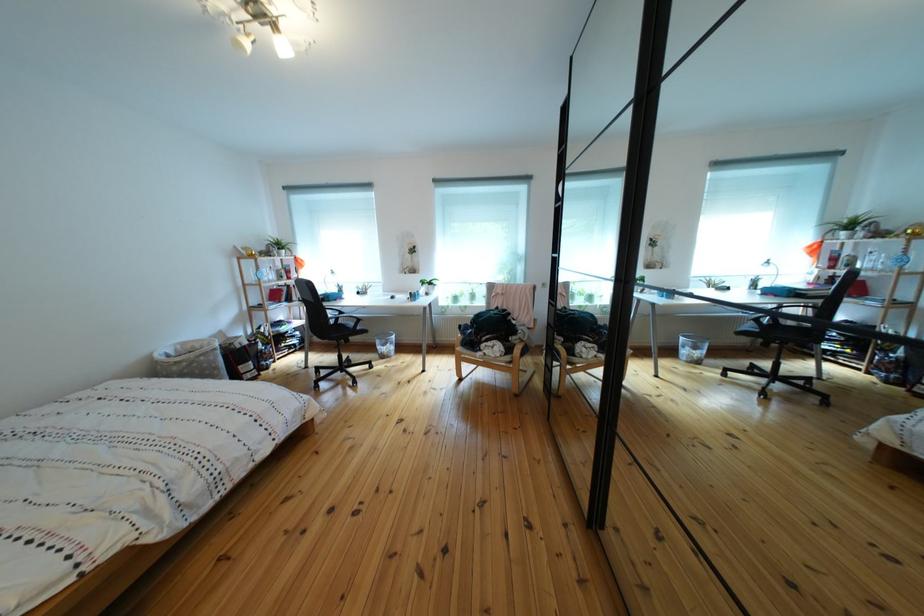
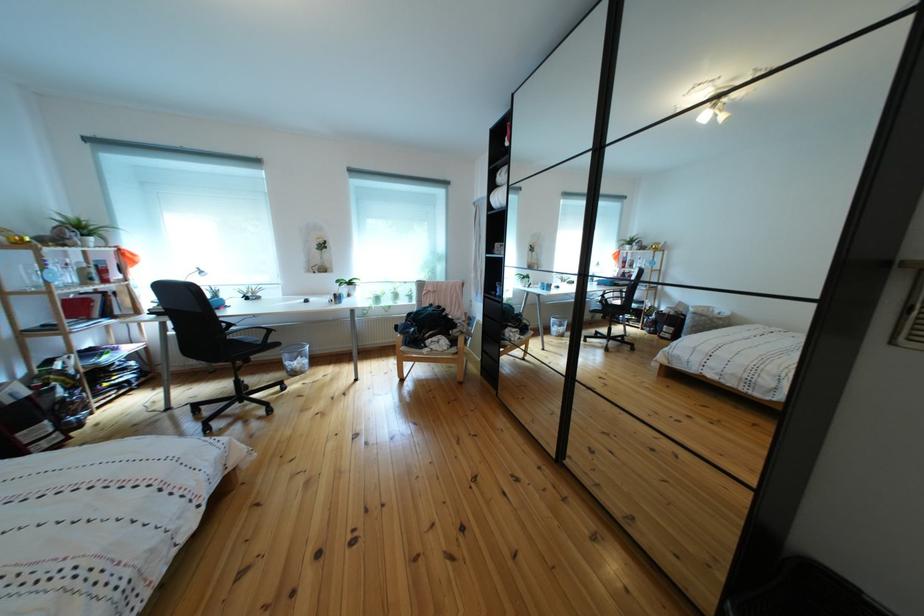
The point at [514,354] is marked in the first image. Where is the corresponding point in the second image?

(458, 347)